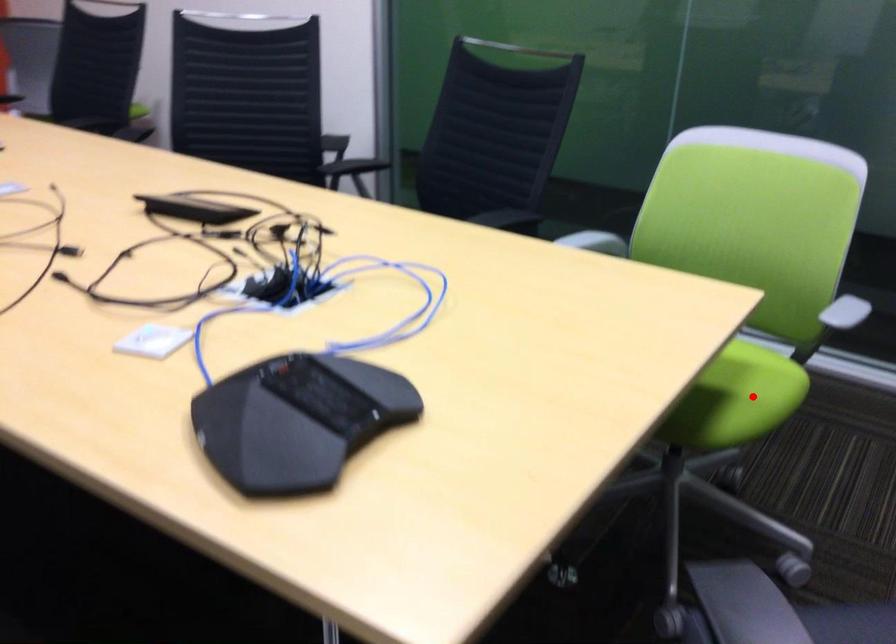
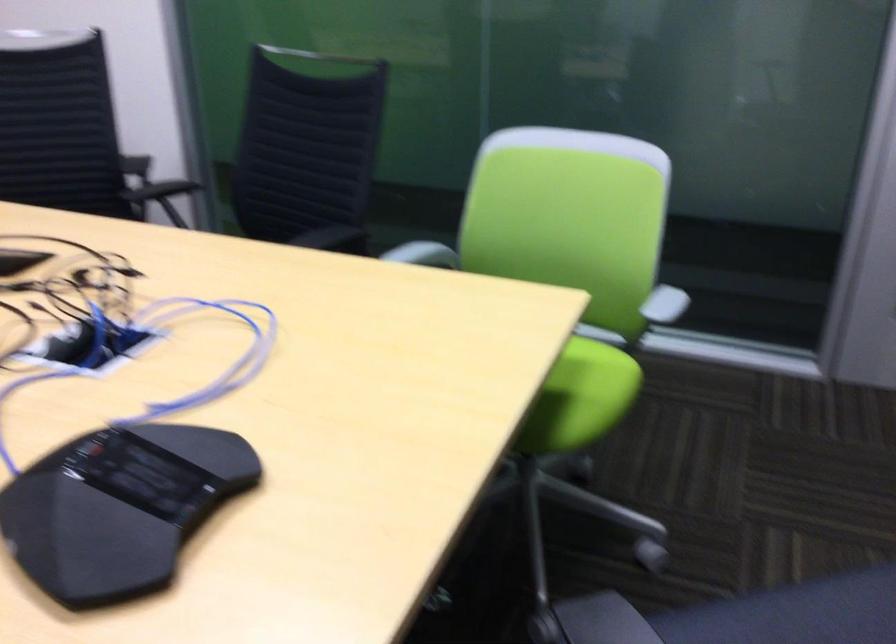
The point at the highlighted location is marked in the first image. Where is the corresponding point in the second image?

(590, 392)